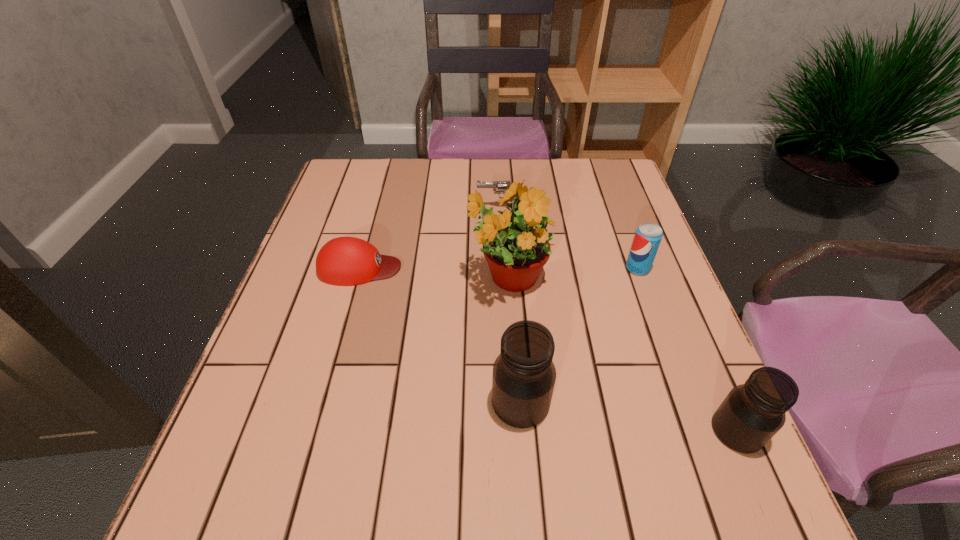
I want to click on vacant point located between the flowerpot and the fourth shortest object, so click(x=622, y=355).

Image resolution: width=960 pixels, height=540 pixels. I want to click on unoccupied position between the third shortest object and the pistol, so click(569, 238).

You are a GUI agent. You are given a task and a screenshot of the screen. Output one action in this format:
    pyautogui.click(x=<x>, y=<y>)
    Task: Click on the empty location between the taller jar and the shorter jar
    This screenshot has width=960, height=540.
    Given the screenshot: What is the action you would take?
    [x=629, y=416]

At what (x,y) coordinates should I click in order to perform the action: click on vacant area between the fourth shortest object and the third shortest object. Please return your answer as a coordinate pair (x, y). Looking at the image, I should click on (687, 349).

What are the coordinates of `blank region between the pistol and the soda can` in the screenshot? It's located at (569, 238).

Identify the location of object that is the fourth nearest to the fourth tallest object. Image resolution: width=960 pixels, height=540 pixels. (524, 375).

The width and height of the screenshot is (960, 540). What are the coordinates of `object that is the fourth closest to the baseball cap` in the screenshot? It's located at (648, 236).

Locate an element on the screen. The height and width of the screenshot is (540, 960). vacant area in the image that satisfies the following two spatial constraints: 1. at the barrel of the pistol; 2. on the back side of the soda can is located at coordinates (505, 268).

This screenshot has width=960, height=540. I want to click on free space in the image that satisfies the following two spatial constraints: 1. at the barrel of the farthest object; 2. on the back side of the fourth shortest object, so click(514, 430).

The width and height of the screenshot is (960, 540). I want to click on vacant position in the image that satisfies the following two spatial constraints: 1. on the back side of the right jar; 2. at the barrel of the farthest object, so click(x=640, y=207).